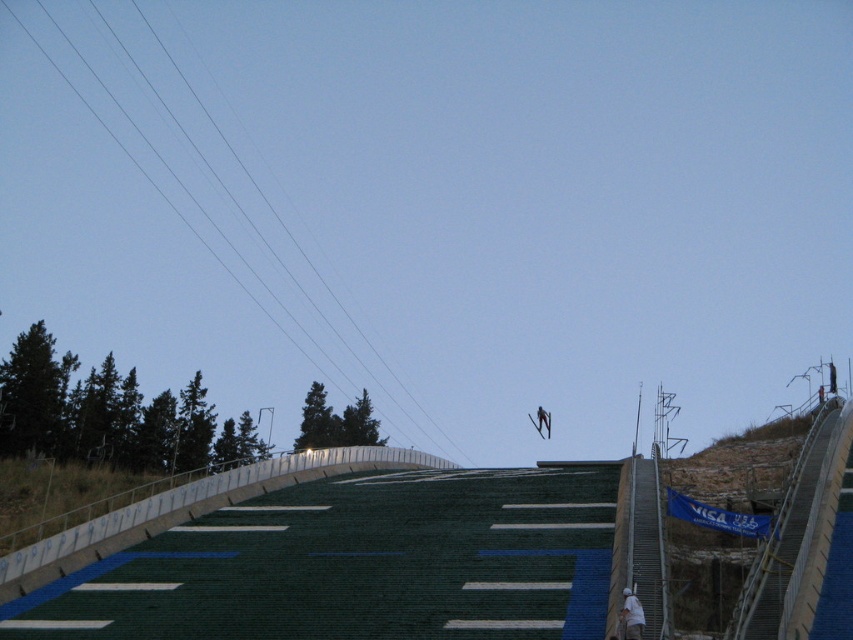
You are a photographer trying to capture the white fabric at lower right. The camera is positioned at the point with coordinates point (x=631, y=616). Where should you look to find the white fabric?

The point (x=631, y=616) indicates the location of the white fabric at lower right, so you should look directly at the point (x=631, y=616) to find the white fabric at lower right.

You are a photographer capturing the ski jumping event. You notice the white fabric at lower right and the metallic silver ski at center. Which object is positioned higher in the image?

The white fabric at lower right is above the metallic silver ski at center, so it is positioned higher in the image.